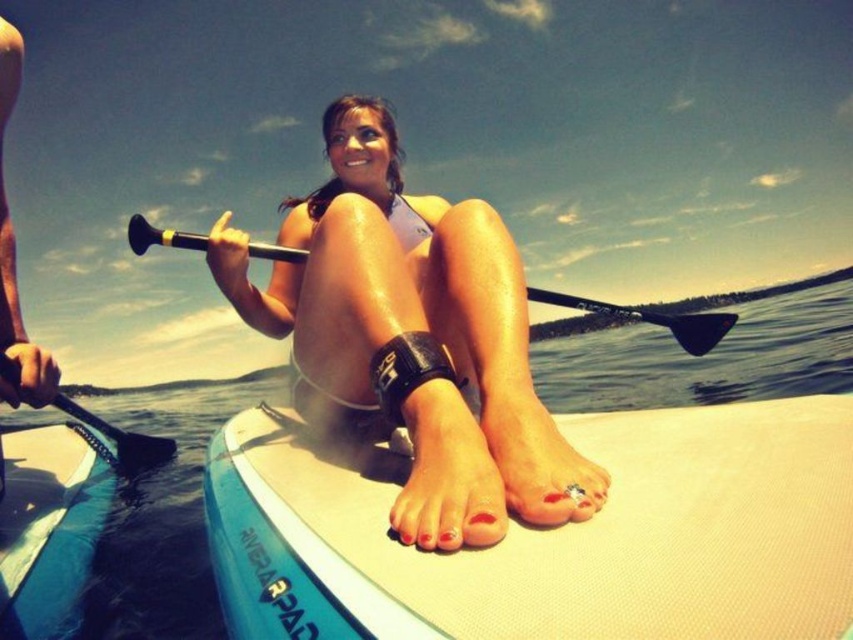
Consider the image. You are a photographer trying to capture a clear photo of the matte white surfboard at center and the black rubber paddle at left. Which object should you focus on first to ensure both are in focus?

The matte white surfboard at center is in front of the black rubber paddle at left, so you should focus on the matte white surfboard at center first to ensure both are in focus.

You are a photographer trying to capture the perfect shot of the matte white surfboard at center and the black rubber paddle at left. Since you want to ensure both objects are clearly visible in the frame, which object should you focus on first to account for their sizes?

The matte white surfboard at center has a lesser width compared to the black rubber paddle at left, so you should focus on the black rubber paddle at left first as it is wider and might require more attention to detail to fit into the frame properly.